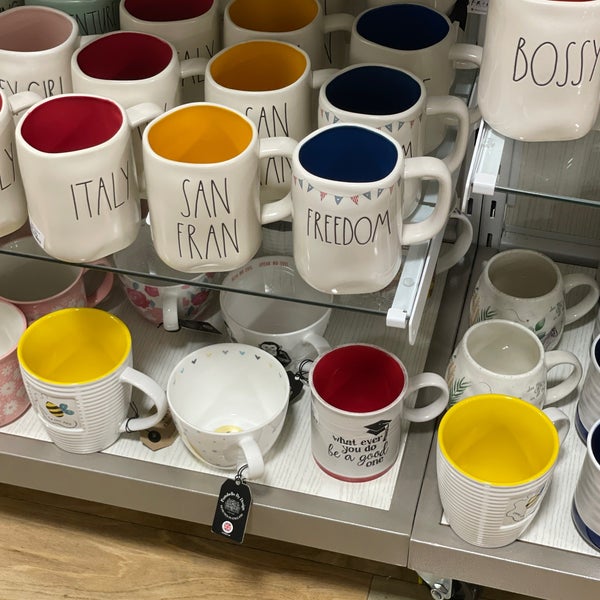
Where is `glass shelving`? glass shelving is located at coordinates (548, 174), (381, 304).